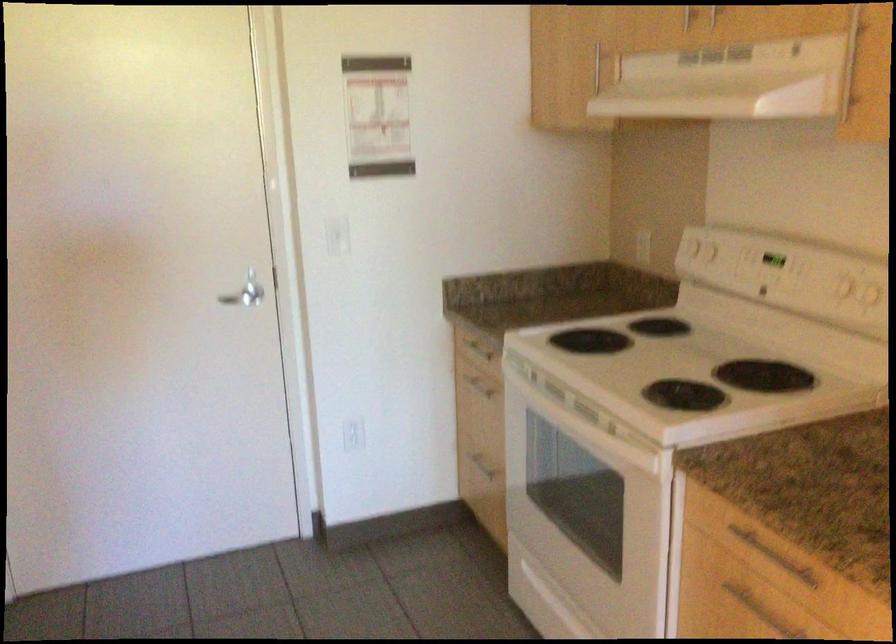
I want to click on white stove dial, so click(x=686, y=365).